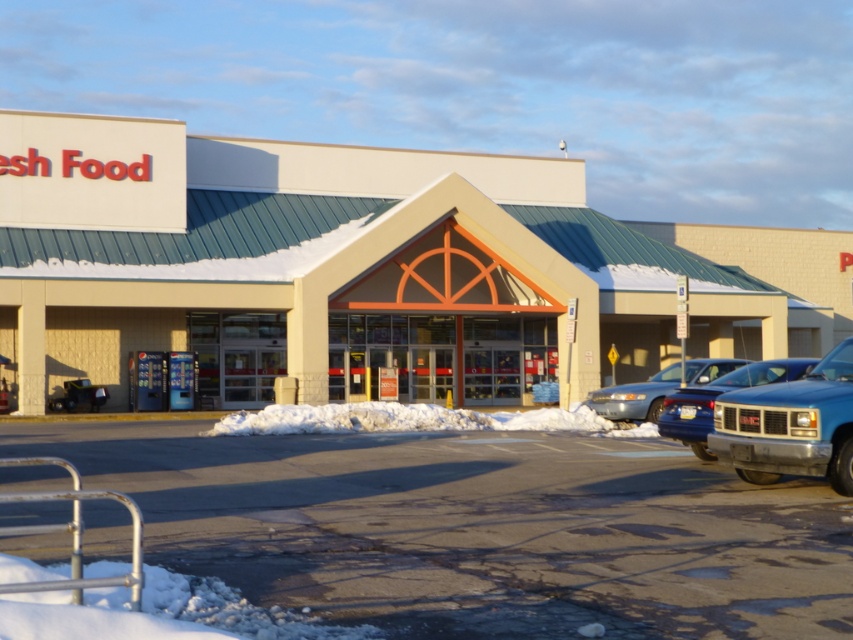
Does pavement asphalt at center have a larger size compared to blue metallic sedan at center?

Yes.

What do you see at coordinates (476, 529) in the screenshot?
I see `pavement asphalt at center` at bounding box center [476, 529].

Locate an element on the screen. The image size is (853, 640). pavement asphalt at center is located at coordinates (476, 529).

Is point (221, 576) in front of point (763, 371)?

Yes.

What do you see at coordinates (476, 529) in the screenshot? I see `pavement asphalt at center` at bounding box center [476, 529].

Where is `pavement asphalt at center`? pavement asphalt at center is located at coordinates (476, 529).

Is beige/concrete mall at center to the right of pavement asphalt at center from the viewer's perspective?

Indeed, beige/concrete mall at center is positioned on the right side of pavement asphalt at center.

Does beige/concrete mall at center appear on the left side of pavement asphalt at center?

No, beige/concrete mall at center is not to the left of pavement asphalt at center.

Is point (665, 225) farther from viewer compared to point (425, 611)?

Yes, point (665, 225) is farther from viewer.

At what (x,y) coordinates should I click in order to perform the action: click on beige/concrete mall at center. Please return your answer as a coordinate pair (x, y). The width and height of the screenshot is (853, 640). Looking at the image, I should click on (367, 269).